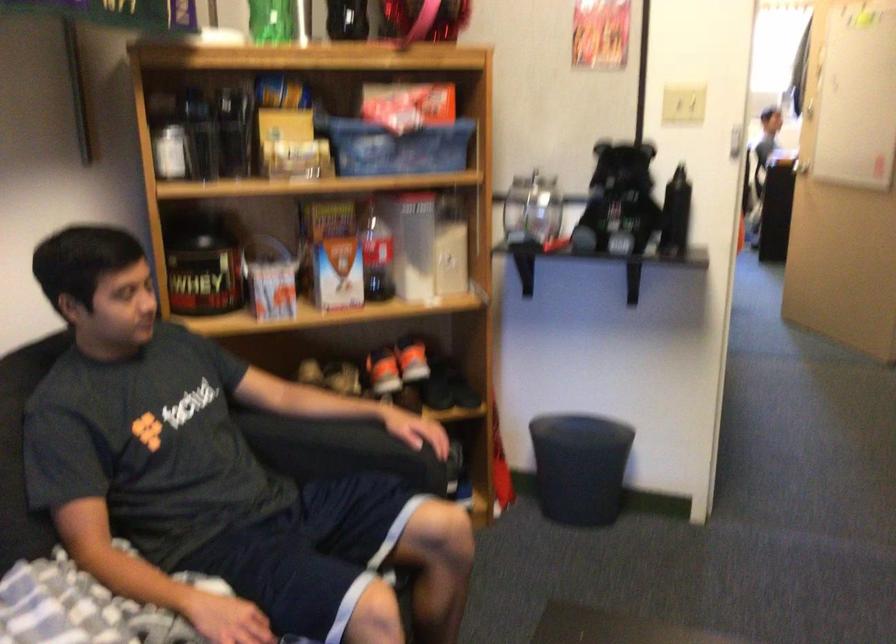
Locate an element on the screen. The height and width of the screenshot is (644, 896). white light switch is located at coordinates coord(682,106).